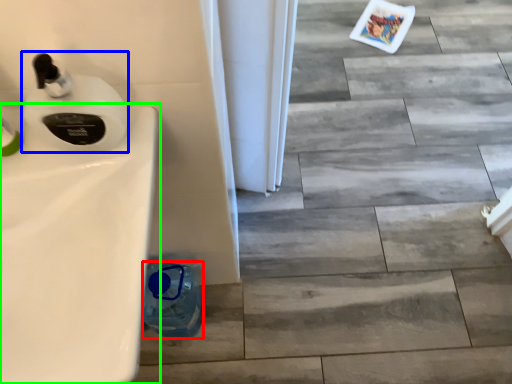
Question: Which is nearer to the bottle (highlighted by a red box)? soap dispenser (highlighted by a blue box) or sink (highlighted by a green box).

Choices:
 (A) soap dispenser
 (B) sink

Answer: (B)